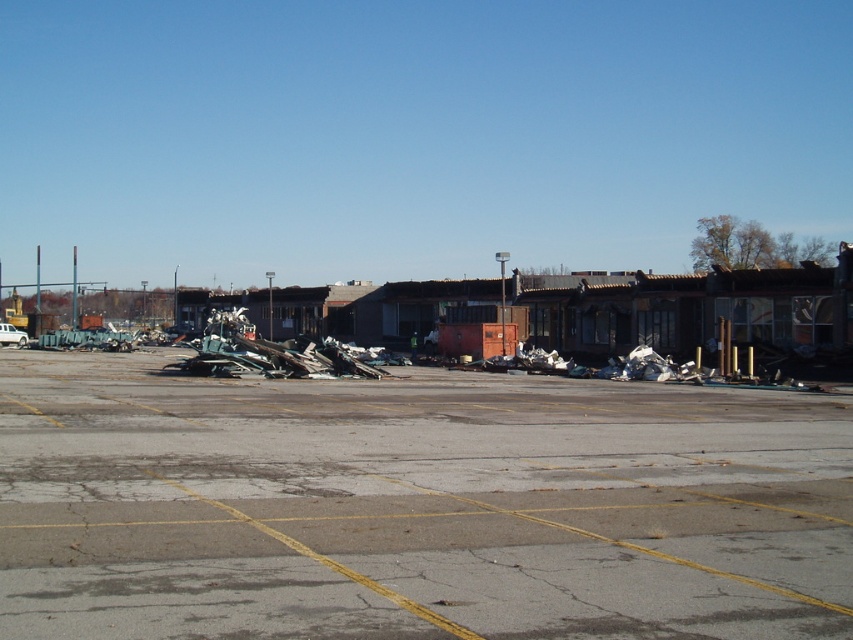
Which of these two, gray asphalt parking lot at center or white matte truck at center, stands shorter?

gray asphalt parking lot at center

Does gray asphalt parking lot at center appear under white matte truck at center?

Yes.

Is point (659, 484) closer to viewer compared to point (0, 323)?

Yes, it is in front of point (0, 323).

The width and height of the screenshot is (853, 640). I want to click on gray asphalt parking lot at center, so 415,506.